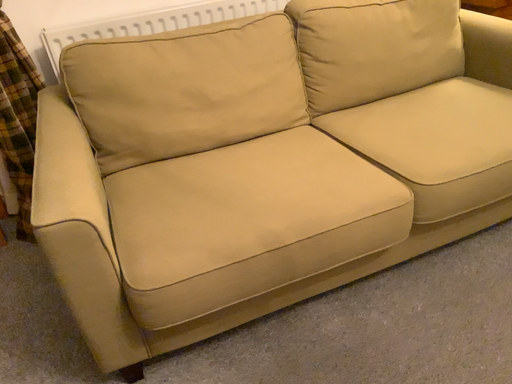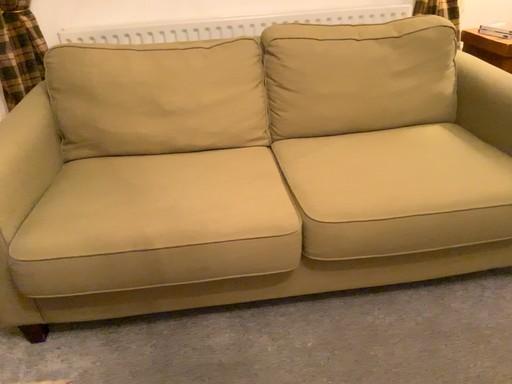
Question: Which way did the camera rotate in the video?

Choices:
 (A) rotated left
 (B) rotated right

Answer: (A)